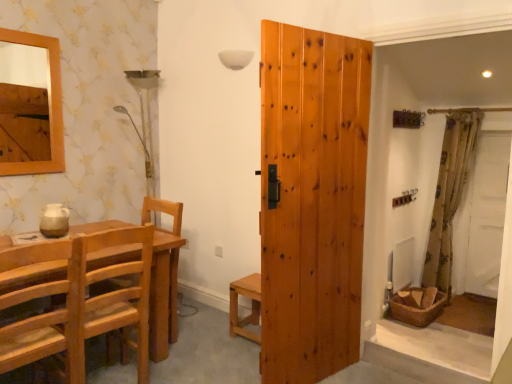
At what (x,y) coordinates should I click in order to perform the action: click on free region under light brown wooden chair at left, placed as the 2th chair when sorted from front to back (from a real-world perspective). Please return your answer as a coordinate pair (x, y). Looking at the image, I should click on (110, 374).